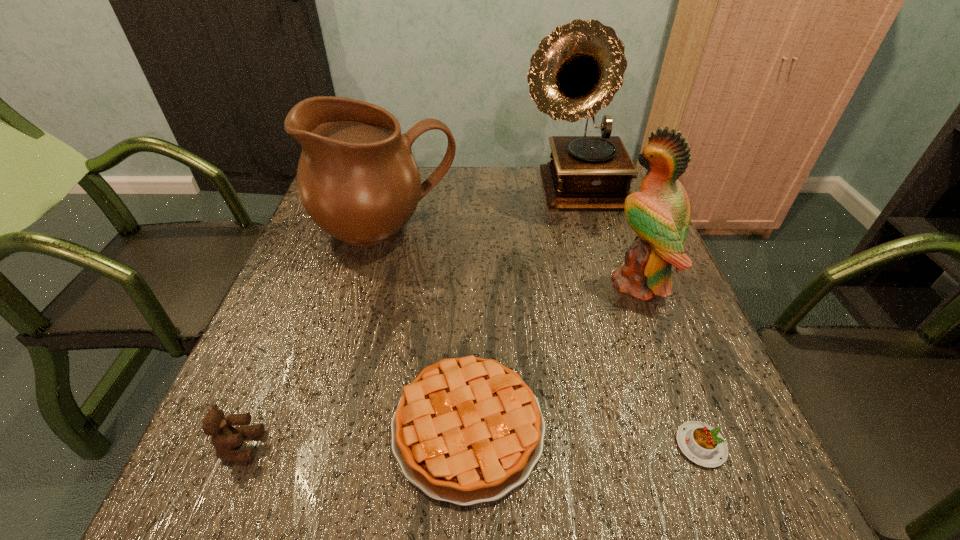
Locate an element on the screen. vacant area at the right edge of the desktop is located at coordinates (674, 403).

Identify the location of blank region between the fourth tallest object and the pie. The width and height of the screenshot is (960, 540). (355, 436).

I want to click on free space between the pudding and the cream pitcher, so click(543, 338).

Image resolution: width=960 pixels, height=540 pixels. Find the location of `unoccupied area between the tallest object and the cream pitcher`. unoccupied area between the tallest object and the cream pitcher is located at coordinates (482, 211).

At what (x,y) coordinates should I click in order to perform the action: click on vacant area between the fifth tallest object and the shortest object. Please return your answer as a coordinate pair (x, y). The width and height of the screenshot is (960, 540). Looking at the image, I should click on (585, 436).

Where is `free area in between the pie and the shortest object`? The height and width of the screenshot is (540, 960). free area in between the pie and the shortest object is located at coordinates (585, 436).

Find the location of `vacant area that lies between the cream pitcher and the parrot`. vacant area that lies between the cream pitcher and the parrot is located at coordinates (513, 256).

The image size is (960, 540). What are the coordinates of `vacant area between the pudding and the record player` in the screenshot? It's located at (638, 319).

You are a GUI agent. You are given a task and a screenshot of the screen. Output one action in this format:
    pyautogui.click(x=<x>, y=<y>)
    Task: Click on the free area in between the pie and the fourth tallest object
    
    Given the screenshot: What is the action you would take?
    pyautogui.click(x=355, y=436)

Point out which object is positioned as the second nearest to the fifth tallest object. Please provide its 2D coordinates. Your answer should be formatted as a tuple, i.e. [(x, y)], where the tuple contains the x and y coordinates of a point satisfying the conditions above.

[(704, 445)]